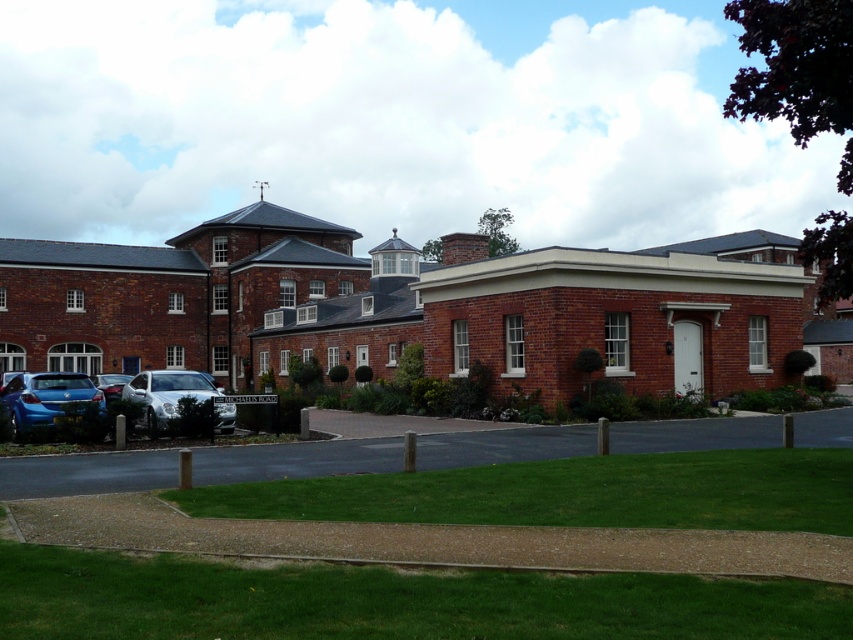
Question: Which is farther from the metallic silver car at center-left?

Choices:
 (A) metallic blue sedan at lower left
 (B) satin silver car at center

Answer: (A)

Question: Which object is farther from the camera taking this photo?

Choices:
 (A) metallic silver car at center-left
 (B) satin silver car at center

Answer: (A)

Question: Is metallic blue sedan at lower left above metallic silver car at center-left?

Choices:
 (A) no
 (B) yes

Answer: (B)

Question: Where is satin silver car at center located in relation to metallic silver car at center-left in the image?

Choices:
 (A) below
 (B) above

Answer: (B)

Question: Which of the following is the closest to the observer?

Choices:
 (A) metallic silver car at center-left
 (B) metallic blue sedan at lower left

Answer: (B)

Question: Does satin silver car at center have a larger size compared to metallic silver car at center-left?

Choices:
 (A) yes
 (B) no

Answer: (A)